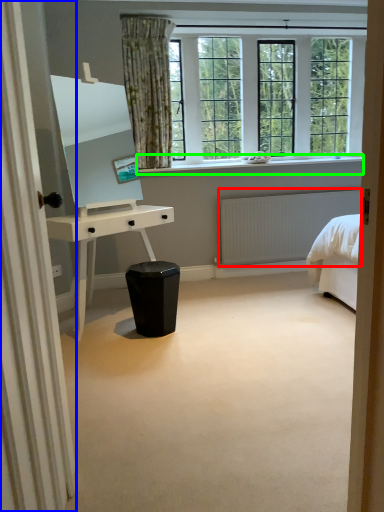
Question: Which object is the closest to the radiator (highlighted by a red box)? Choose among these: curtain (highlighted by a blue box) or window sill (highlighted by a green box).

Choices:
 (A) curtain
 (B) window sill

Answer: (B)